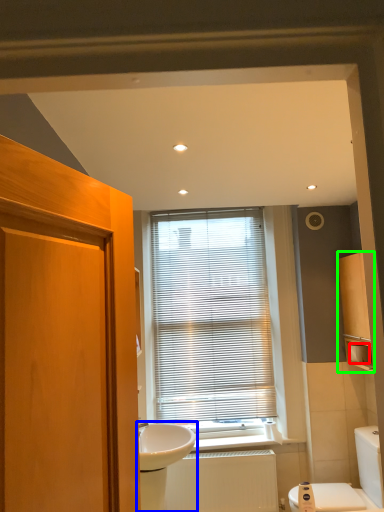
Question: Estimate the real-world distances between objects in this image. Which object is farther from toilet paper (highlighted by a red box), sink (highlighted by a blue box) or cabinetry (highlighted by a green box)?

Choices:
 (A) sink
 (B) cabinetry

Answer: (A)